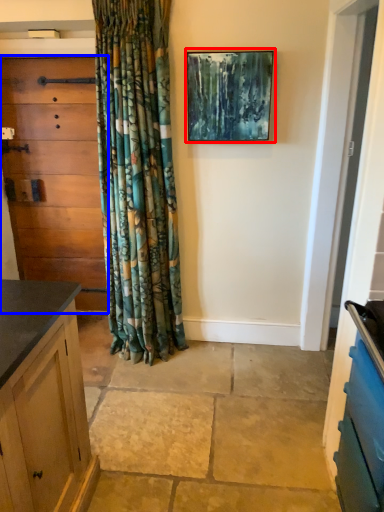
Question: Among these objects, which one is nearest to the camera, picture frame (highlighted by a red box) or chest of drawers (highlighted by a blue box)?

Choices:
 (A) picture frame
 (B) chest of drawers

Answer: (A)